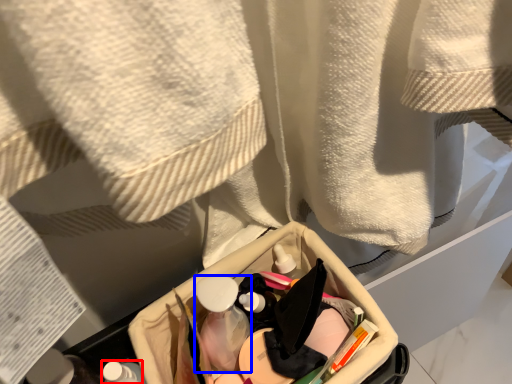
Question: Which object is closer to the camera taking this photo, toiletry (highlighted by a red box) or mouthwash (highlighted by a blue box)?

Choices:
 (A) toiletry
 (B) mouthwash

Answer: (A)